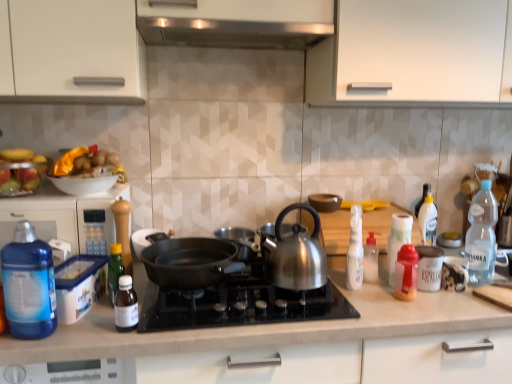
Question: Is black matte pan at center taller than green glass bottle at left, which ranks as the 2th bottle in left-to-right order?

Choices:
 (A) no
 (B) yes

Answer: (A)

Question: Can you confirm if black matte pan at center is bigger than green glass bottle at left, which ranks as the 2th bottle in left-to-right order?

Choices:
 (A) no
 (B) yes

Answer: (B)

Question: Is black matte pan at center placed right next to green glass bottle at left, which ranks as the 2th bottle in left-to-right order?

Choices:
 (A) no
 (B) yes

Answer: (A)

Question: Can you confirm if black matte pan at center is shorter than green glass bottle at left, which ranks as the 2th bottle in left-to-right order?

Choices:
 (A) yes
 (B) no

Answer: (A)

Question: Can you confirm if black matte pan at center is smaller than green glass bottle at left, the 7th bottle from the right?

Choices:
 (A) no
 (B) yes

Answer: (A)

Question: Considering the relative positions of black matte pan at center and green glass bottle at left, which ranks as the 2th bottle in left-to-right order, in the image provided, is black matte pan at center in front of green glass bottle at left, which ranks as the 2th bottle in left-to-right order,?

Choices:
 (A) no
 (B) yes

Answer: (B)

Question: Considering the relative sizes of green glass bottle at left, which ranks as the 2th bottle in left-to-right order, and brown matte bowl at center, marked as the 3th kitchen appliance in a left-to-right arrangement, in the image provided, is green glass bottle at left, which ranks as the 2th bottle in left-to-right order, taller than brown matte bowl at center, marked as the 3th kitchen appliance in a left-to-right arrangement,?

Choices:
 (A) no
 (B) yes

Answer: (B)

Question: From a real-world perspective, is green glass bottle at left, which ranks as the 2th bottle in left-to-right order, physically below brown matte bowl at center, positioned as the 2th kitchen appliance in right-to-left order?

Choices:
 (A) no
 (B) yes

Answer: (B)

Question: Considering the relative sizes of green glass bottle at left, the 7th bottle from the right, and brown matte bowl at center, marked as the 3th kitchen appliance in a left-to-right arrangement, in the image provided, is green glass bottle at left, the 7th bottle from the right, smaller than brown matte bowl at center, marked as the 3th kitchen appliance in a left-to-right arrangement,?

Choices:
 (A) yes
 (B) no

Answer: (A)

Question: Is green glass bottle at left, the 7th bottle from the right, oriented away from brown matte bowl at center, positioned as the 2th kitchen appliance in right-to-left order?

Choices:
 (A) no
 (B) yes

Answer: (A)

Question: Can you confirm if green glass bottle at left, the 7th bottle from the right, is thinner than brown matte bowl at center, marked as the 3th kitchen appliance in a left-to-right arrangement?

Choices:
 (A) no
 (B) yes

Answer: (B)

Question: Does green glass bottle at left, the 7th bottle from the right, lie behind brown matte bowl at center, positioned as the 2th kitchen appliance in right-to-left order?

Choices:
 (A) yes
 (B) no

Answer: (B)

Question: From a real-world perspective, does blue plastic container at left sit lower than translucent plastic bottle at lower left, marked as the sixth bottle in a right-to-left arrangement?

Choices:
 (A) no
 (B) yes

Answer: (A)